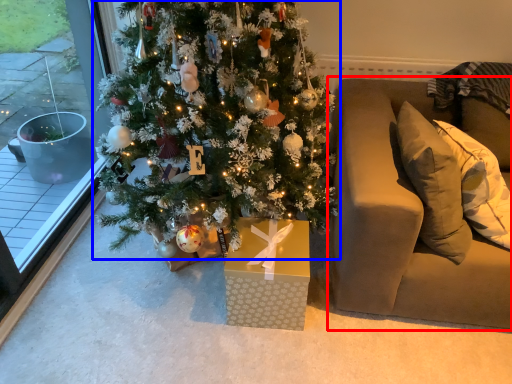
Question: Among these objects, which one is nearest to the camera, studio couch (highlighted by a red box) or christmas tree (highlighted by a blue box)?

Choices:
 (A) studio couch
 (B) christmas tree

Answer: (B)